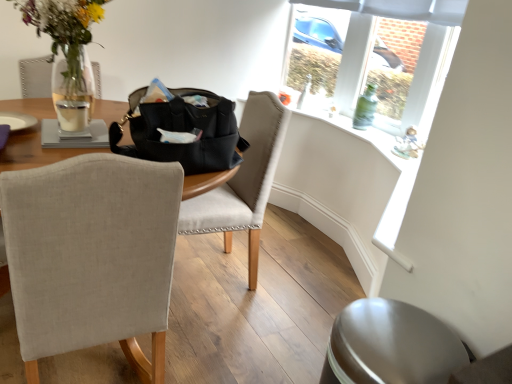
Identify the location of green glass bottle at upper right. Image resolution: width=512 pixels, height=384 pixels. (365, 108).

What is the approximate width of black leather handbag at center?

black leather handbag at center is 13.47 inches in width.

What do you see at coordinates (92, 256) in the screenshot? I see `beige fabric chair at left, the first chair viewed from the front` at bounding box center [92, 256].

This screenshot has height=384, width=512. Describe the element at coordinates (72, 115) in the screenshot. I see `white matte candle at table left` at that location.

This screenshot has width=512, height=384. What do you see at coordinates (391, 345) in the screenshot?
I see `metallic silver swivel chair at lower right` at bounding box center [391, 345].

Where is `green glass bottle at upper right`? The height and width of the screenshot is (384, 512). green glass bottle at upper right is located at coordinates (365, 108).

Would you say translucent glass vase with flowers at upper left is outside green glass bottle at upper right?

translucent glass vase with flowers at upper left lies outside green glass bottle at upper right's area.

From a real-world perspective, is translucent glass vase with flowers at upper left on top of green glass bottle at upper right?

Yes.

Does translucent glass vase with flowers at upper left appear on the left side of green glass bottle at upper right?

Indeed, translucent glass vase with flowers at upper left is positioned on the left side of green glass bottle at upper right.

Is clear glass vase at upper right next to translucent glass vase with flowers at upper left and touching it?

No.

Would you say clear glass vase at upper right is to the left or to the right of translucent glass vase with flowers at upper left in the picture?

Based on their positions, clear glass vase at upper right is located to the right of translucent glass vase with flowers at upper left.

Is clear glass vase at upper right positioned with its back to translucent glass vase with flowers at upper left?

That's not correct — clear glass vase at upper right is not looking away from translucent glass vase with flowers at upper left.

Locate an element on the screen. bay window lying on the right of translucent glass vase with flowers at upper left is located at coordinates 371,64.

Is green glass bottle at upper right oriented away from light beige fabric chair at center, arranged as the 2th chair when viewed from the front?

No.

Considering the relative sizes of green glass bottle at upper right and light beige fabric chair at center, arranged as the 2th chair when viewed from the front, in the image provided, is green glass bottle at upper right thinner than light beige fabric chair at center, arranged as the 2th chair when viewed from the front,?

Indeed, green glass bottle at upper right has a lesser width compared to light beige fabric chair at center, arranged as the 2th chair when viewed from the front.

Do you think green glass bottle at upper right is within light beige fabric chair at center, positioned as the 1th chair in back-to-front order, or outside of it?

green glass bottle at upper right is not inside light beige fabric chair at center, positioned as the 1th chair in back-to-front order, it's outside.

From a real-world perspective, is green glass bottle at upper right positioned under light beige fabric chair at center, arranged as the 2th chair when viewed from the front, based on gravity?

No, from a real-world perspective, green glass bottle at upper right is not under light beige fabric chair at center, arranged as the 2th chair when viewed from the front.

Is clear glass vase at upper right far away from green glass bottle at upper right?

No, clear glass vase at upper right is not far from green glass bottle at upper right.

Between clear glass vase at upper right and green glass bottle at upper right, which one is positioned in front?

Positioned in front is clear glass vase at upper right.

From the image's perspective, which one is positioned lower, clear glass vase at upper right or green glass bottle at upper right?

green glass bottle at upper right is shown below in the image.

In the scene shown: From a real-world perspective, who is located higher, clear glass vase at upper right or green glass bottle at upper right?

From a 3D spatial view, clear glass vase at upper right is above.

Considering the positions of points (404, 353) and (80, 19), is point (404, 353) closer to camera compared to point (80, 19)?

Yes, it is in front of point (80, 19).

Is metallic silver swivel chair at lower right bigger than translucent glass vase with flowers at upper left?

No, metallic silver swivel chair at lower right is not bigger than translucent glass vase with flowers at upper left.

Is translucent glass vase with flowers at upper left surrounded by metallic silver swivel chair at lower right?

No, metallic silver swivel chair at lower right does not contain translucent glass vase with flowers at upper left.

The image size is (512, 384). In order to click on floral arrangement behind the metallic silver swivel chair at lower right in this screenshot , I will do `click(64, 30)`.

This screenshot has width=512, height=384. In order to click on beverage positioned vertically above the beige fabric chair at left, the first chair viewed from the front (from a real-world perspective) in this screenshot , I will do `click(72, 115)`.

From the image's perspective, which is below, white matte candle at table left or beige fabric chair at left, the first chair viewed from the front?

beige fabric chair at left, the first chair viewed from the front, from the image's perspective.

From a real-world perspective, who is located lower, white matte candle at table left or beige fabric chair at left, the first chair viewed from the front?

beige fabric chair at left, the first chair viewed from the front, from a real-world perspective.

Which is in front, white matte candle at table left or beige fabric chair at left, marked as the 2th chair in a back-to-front arrangement?

Positioned in front is beige fabric chair at left, marked as the 2th chair in a back-to-front arrangement.

Who is shorter, beige fabric chair at left, marked as the 2th chair in a back-to-front arrangement, or light beige fabric chair at center, arranged as the 2th chair when viewed from the front?

light beige fabric chair at center, arranged as the 2th chair when viewed from the front.

Is beige fabric chair at left, the first chair viewed from the front, placed right next to light beige fabric chair at center, positioned as the 1th chair in back-to-front order?

There is a gap between beige fabric chair at left, the first chair viewed from the front, and light beige fabric chair at center, positioned as the 1th chair in back-to-front order.

Does point (61, 329) come behind point (272, 149)?

No, (61, 329) is in front of (272, 149).

You are a GUI agent. You are given a task and a screenshot of the screen. Output one action in this format:
    pyautogui.click(x=<x>, y=<y>)
    Task: Click on the floral arrangement in front of the green glass bottle at upper right
    
    Given the screenshot: What is the action you would take?
    (x=64, y=30)

Locate an element on the screen. This screenshot has height=384, width=512. bay window behind the translucent glass vase with flowers at upper left is located at coordinates (371, 64).

Considering their positions, is green glass bottle at upper right positioned further to white matte candle at table left than black leather handbag at center?

green glass bottle at upper right is further to white matte candle at table left.

When comparing their distances from white matte candle at table left, does metallic silver swivel chair at lower right or light beige fabric chair at center, arranged as the 2th chair when viewed from the front, seem further?

Among the two, metallic silver swivel chair at lower right is located further to white matte candle at table left.

Looking at the image, which one is located closer to green glass bottle at upper right, black leather handbag at center or clear glass vase at upper right?

clear glass vase at upper right is closer to green glass bottle at upper right.

Which object lies further to the anchor point translucent glass vase with flowers at upper left, black leather handbag at center or white matte candle at table left?

A: Based on the image, black leather handbag at center appears to be further to translucent glass vase with flowers at upper left.

Which object lies nearer to the anchor point light beige fabric chair at center, positioned as the 1th chair in back-to-front order, metallic silver swivel chair at lower right or beige fabric chair at left, marked as the 2th chair in a back-to-front arrangement?

The object closer to light beige fabric chair at center, positioned as the 1th chair in back-to-front order, is beige fabric chair at left, marked as the 2th chair in a back-to-front arrangement.

Considering their positions, is metallic silver swivel chair at lower right positioned closer to clear glass vase at upper right than beige fabric chair at left, marked as the 2th chair in a back-to-front arrangement?

metallic silver swivel chair at lower right lies closer to clear glass vase at upper right than the other object.

When comparing their distances from green glass bottle at upper right, does white matte candle at table left or metallic silver swivel chair at lower right seem further?

Based on the image, metallic silver swivel chair at lower right appears to be further to green glass bottle at upper right.

Which object lies nearer to the anchor point green glass bottle at upper right, metallic silver swivel chair at lower right or beige fabric chair at left, the first chair viewed from the front?

metallic silver swivel chair at lower right is positioned closer to the anchor green glass bottle at upper right.

Locate an element on the screen. This screenshot has height=384, width=512. chair between translucent glass vase with flowers at upper left and beige fabric chair at left, the first chair viewed from the front, in the up-down direction is located at coordinates (243, 181).

The width and height of the screenshot is (512, 384). I want to click on beverage situated between translucent glass vase with flowers at upper left and green glass bottle at upper right from left to right, so click(72, 115).

Locate an element on the screen. handbag between white matte candle at table left and metallic silver swivel chair at lower right in the horizontal direction is located at coordinates coord(182,131).

I want to click on beverage positioned between metallic silver swivel chair at lower right and green glass bottle at upper right from near to far, so click(x=72, y=115).